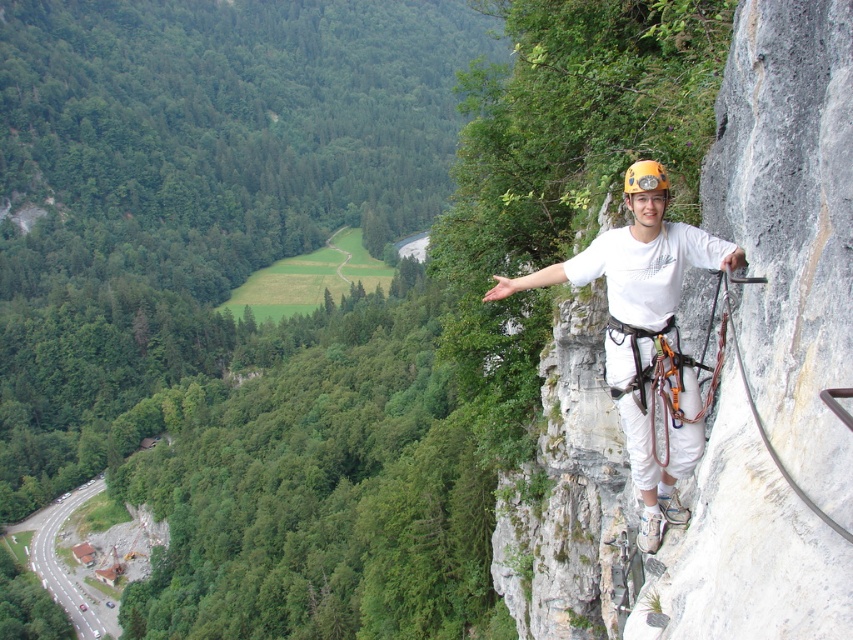
You are a rock climber trying to navigate between two points on the cliff. The first point is at coordinate point (x=607, y=330) and the second is at point (x=662, y=188). Which point should you reach first to ensure you are moving towards the cliff edge?

You should reach point (x=607, y=330) first because it is closer to you than point (x=662, y=188), which is further away from the cliff edge.

You are a safety inspector reviewing a rock climbing setup. You notice two helmets on the climber. The white matte helmet at upper right and the yellow matte helmet at upper right. Which helmet is larger in size?

The white matte helmet at upper right is bigger than the yellow matte helmet at upper right.